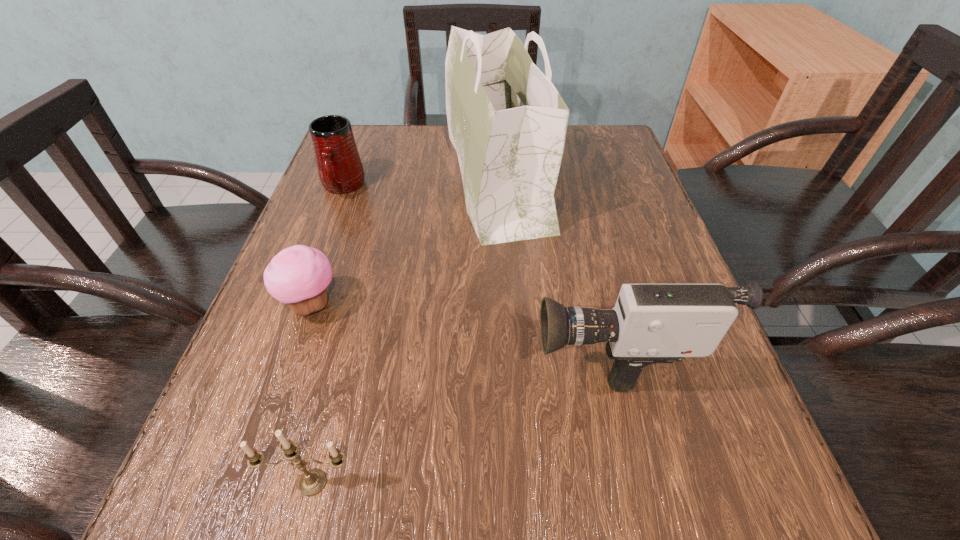
The width and height of the screenshot is (960, 540). Identify the location of vacant space in between the second tallest object and the grocery bag. (554, 265).

You are a GUI agent. You are given a task and a screenshot of the screen. Output one action in this format:
    pyautogui.click(x=<x>, y=<y>)
    Task: Click on the free spot between the mug and the cupcake
    
    Given the screenshot: What is the action you would take?
    pyautogui.click(x=327, y=246)

I want to click on free spot between the cupcake and the nearest object, so click(312, 394).

The width and height of the screenshot is (960, 540). I want to click on free space between the tallest object and the nearest object, so click(405, 331).

Locate an element on the screen. vacant space in between the nearest object and the fourth shortest object is located at coordinates (462, 416).

I want to click on free area in between the tallest object and the mug, so click(420, 183).

Where is `the third closest object to the shortest object`? The height and width of the screenshot is (540, 960). the third closest object to the shortest object is located at coordinates (340, 169).

Identify the location of object that stands as the third closest to the mug. (651, 323).

Identify the location of vacant region that satisfies the following two spatial constraints: 1. on the side of the mug with the handle; 2. on the left side of the cupcake. The height and width of the screenshot is (540, 960). (299, 305).